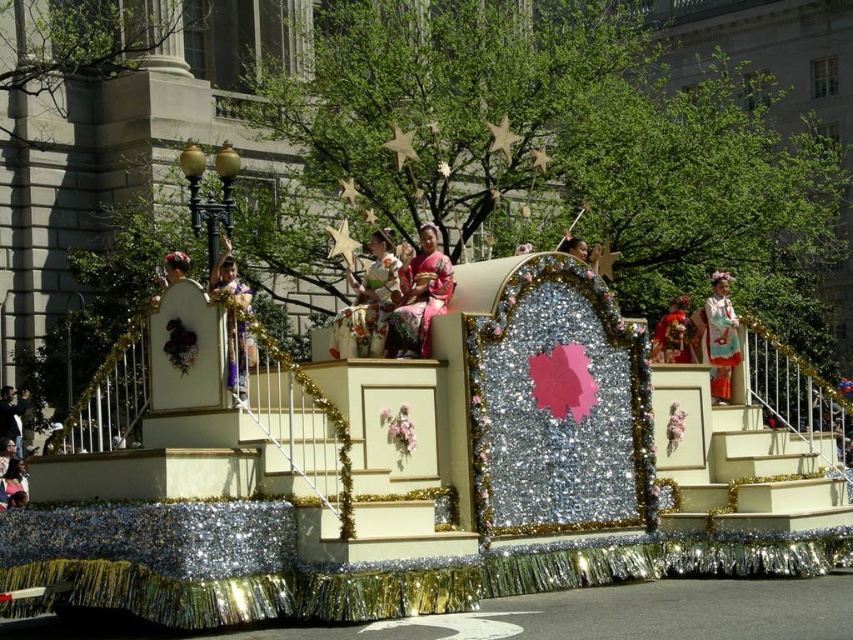
You are standing in front of the parade float and notice two points marked on it. The first point is at coordinate point [233,390] and the second is at point [688,333]. Which point is closer to you?

Point [233,390] is closer to the viewer than point [688,333].

From the picture: You are a photographer trying to capture both the silk kimono at left and the silky pink kimono at center on the float. Since you want both in focus, you need to know their heights. Which kimono is taller?

The silk kimono at left is much taller than the silky pink kimono at center, so you should adjust your camera settings to account for the height difference to ensure both are in focus.

In the scene shown: You are a photographer positioned on the parade route. You want to capture a photo that includes both the pink silk kimono at center and the matte gold kimono at left. Based on their positions, which kimono will appear lower in the photo?

The pink silk kimono at center will appear lower in the photo because it is located below the matte gold kimono at left.